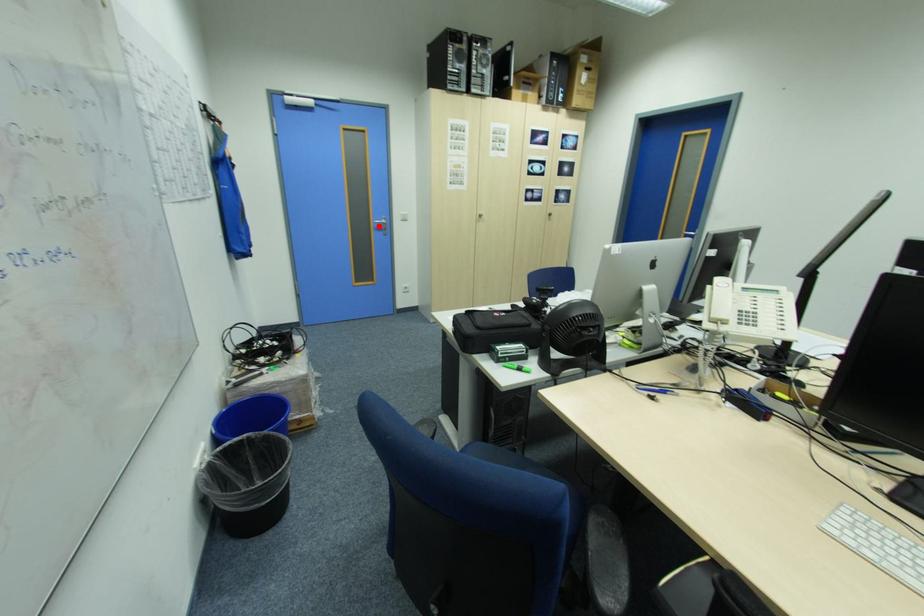
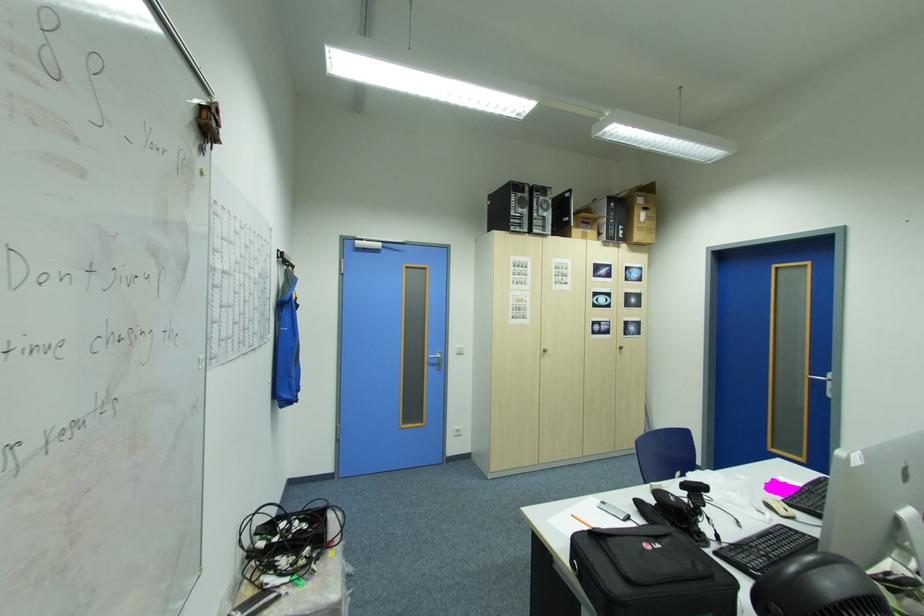
Where in the second image is the point corresponding to the highlighted location from the first image?

(432, 361)